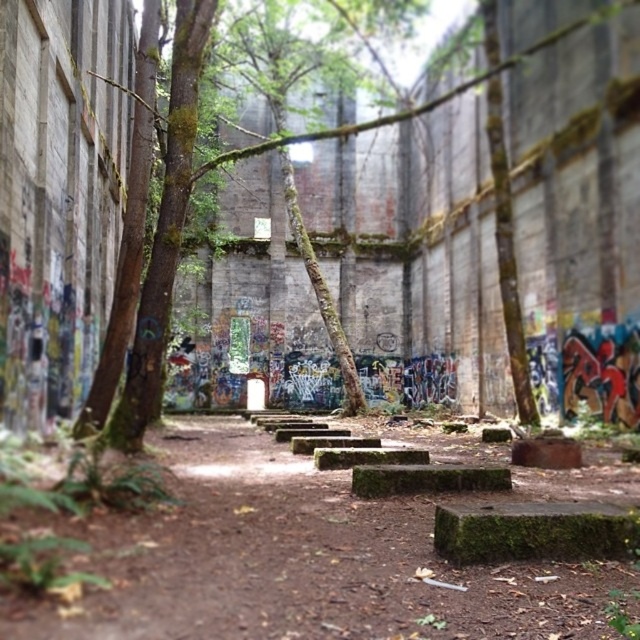
Question: Can you confirm if mossy concrete steps at center is positioned below green mossy tree at center?

Choices:
 (A) yes
 (B) no

Answer: (A)

Question: From the image, what is the correct spatial relationship of mossy concrete steps at center in relation to green mossy tree at center?

Choices:
 (A) above
 (B) below

Answer: (B)

Question: Among these objects, which one is farthest from the camera?

Choices:
 (A) mossy concrete steps at center
 (B) green mossy tree at center

Answer: (B)

Question: Is mossy concrete steps at center below green mossy tree at center?

Choices:
 (A) yes
 (B) no

Answer: (A)

Question: Which point is farther from the camera taking this photo?

Choices:
 (A) (262, 550)
 (B) (115, 321)

Answer: (B)